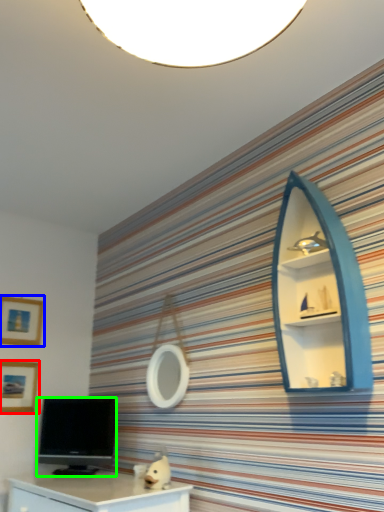
Question: Which object is positioned closest to picture frame (highlighted by a red box)? Select from picture frame (highlighted by a blue box) and television (highlighted by a green box).

Choices:
 (A) picture frame
 (B) television

Answer: (A)